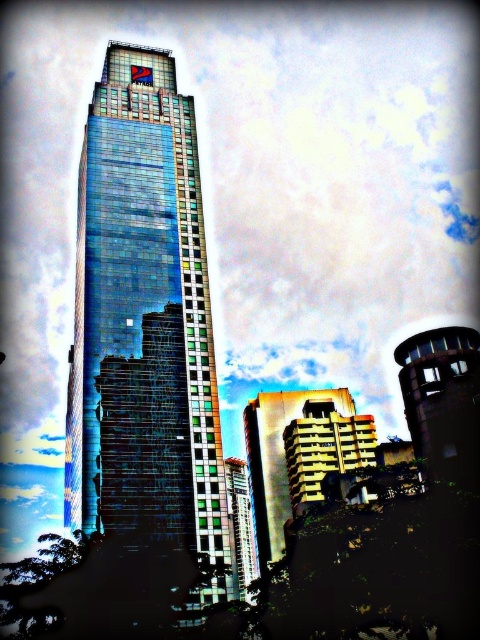
You are an architect analyzing the urban skyline. Which building, the shiny glass skyscraper at center or the metallic gold building at center, has a greater width according to the scene?

The shiny glass skyscraper at center might be wider than metallic gold building at center according to the Objects Description.

You are a city planner assessing the skyline. You need to determine if the shiny glass skyscraper at center will block sunlight to the rustic metal tower at lower right. Can you determine this based on their heights?

The shiny glass skyscraper at center is taller than the rustic metal tower at lower right. Since it is taller and positioned centrally, it could potentially block sunlight to the rustic metal tower at lower right depending on their exact positions and the angle of the sun.